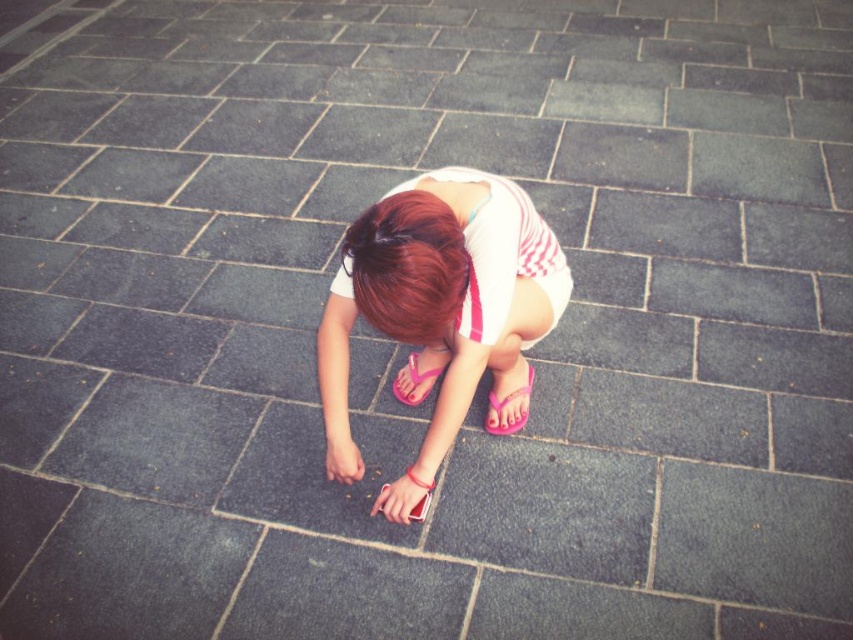
Can you confirm if shiny red hair at center is taller than pink flip-flop at lower center?

Yes, shiny red hair at center is taller than pink flip-flop at lower center.

Is point (402, 204) behind point (495, 428)?

No, (402, 204) is in front of (495, 428).

Who is more forward, (402, 256) or (497, 412)?

Point (402, 256)

You are a GUI agent. You are given a task and a screenshot of the screen. Output one action in this format:
    pyautogui.click(x=<x>, y=<y>)
    Task: Click on the shiny red hair at center
    
    Given the screenshot: What is the action you would take?
    pyautogui.click(x=407, y=266)

Is shiny red hair at center wider than pink rubber sandal at center?

Yes, shiny red hair at center is wider than pink rubber sandal at center.

The height and width of the screenshot is (640, 853). I want to click on shiny red hair at center, so click(407, 266).

Can you confirm if pink flip-flops at center is positioned above shiny red hair at center?

No.

Image resolution: width=853 pixels, height=640 pixels. I want to click on pink flip-flops at center, so click(x=440, y=305).